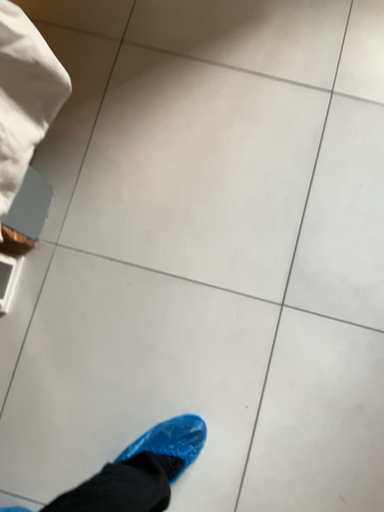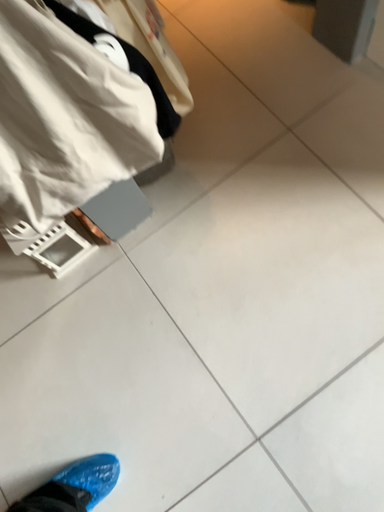
Question: How did the camera likely rotate when shooting the video?

Choices:
 (A) rotated upward
 (B) rotated downward

Answer: (A)